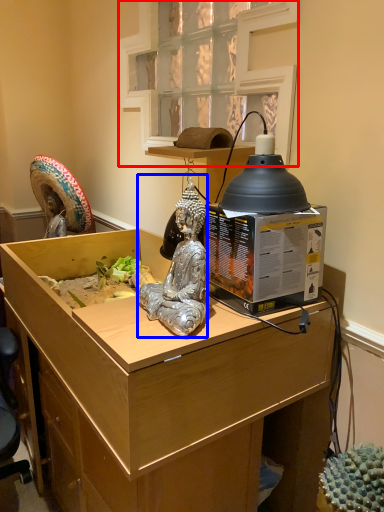
Question: Which point is further to the camera, window (highlighted by a red box) or person (highlighted by a blue box)?

Choices:
 (A) window
 (B) person

Answer: (A)